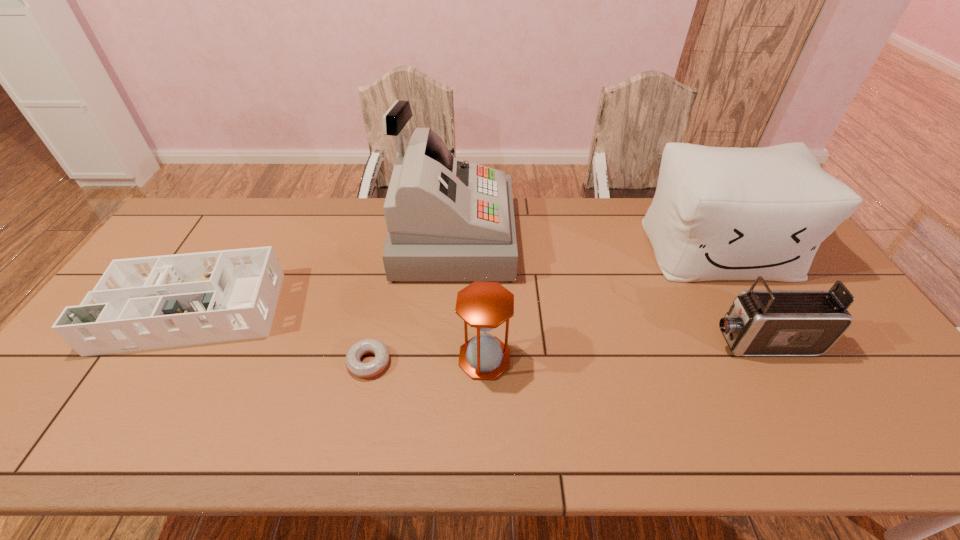
Where is `object located in the far right corner section of the desktop`? object located in the far right corner section of the desktop is located at coordinates (718, 213).

In the image, there is a desktop. What are the coordinates of `vacant space at the far edge` in the screenshot? It's located at (564, 201).

The width and height of the screenshot is (960, 540). I want to click on vacant space at the near edge, so click(x=457, y=450).

The image size is (960, 540). What are the coordinates of `vacant point at the right edge` in the screenshot? It's located at (862, 330).

What are the coordinates of `free location at the far left corner of the desktop` in the screenshot? It's located at (238, 204).

Identify the location of free area in between the cash register and the shortest object. This screenshot has width=960, height=540. (411, 300).

This screenshot has height=540, width=960. I want to click on vacant space that is in between the cash register and the camcorder, so [606, 291].

The height and width of the screenshot is (540, 960). In order to click on unoccupied area between the tallest object and the dollhouse in this screenshot , I will do `click(326, 272)`.

The width and height of the screenshot is (960, 540). I want to click on free spot between the tallest object and the camcorder, so click(606, 291).

You are a GUI agent. You are given a task and a screenshot of the screen. Output one action in this format:
    pyautogui.click(x=<x>, y=<y>)
    Task: Click on the free space between the leftmost object and the tallest object
    Image resolution: width=960 pixels, height=540 pixels.
    Given the screenshot: What is the action you would take?
    pyautogui.click(x=326, y=272)